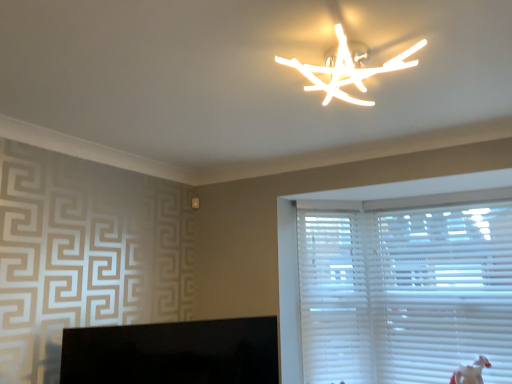
Describe the element at coordinates (337, 297) in the screenshot. I see `white plastic blinds at right` at that location.

Locate an element on the screen. The image size is (512, 384). white plastic blinds at right is located at coordinates (406, 287).

The width and height of the screenshot is (512, 384). In order to click on white plastic blinds at right in this screenshot , I will do `click(337, 297)`.

Find the location of a particular element. This screenshot has height=384, width=512. window blind below the white matte branch-like fixture at upper center (from the image's perspective) is located at coordinates (406, 287).

Considering the sizes of objects white matte branch-like fixture at upper center and white plastic blinds at right in the image provided, who is shorter, white matte branch-like fixture at upper center or white plastic blinds at right?

With less height is white matte branch-like fixture at upper center.

Can you confirm if white matte branch-like fixture at upper center is wider than white plastic blinds at right?

Correct, the width of white matte branch-like fixture at upper center exceeds that of white plastic blinds at right.

How much distance is there between white matte branch-like fixture at upper center and white plastic blinds at right?

A distance of 1.68 meters exists between white matte branch-like fixture at upper center and white plastic blinds at right.

How much distance is there between white plastic blinds at right and white matte branch-like fixture at upper center?

The distance of white plastic blinds at right from white matte branch-like fixture at upper center is 1.68 meters.

Is white matte branch-like fixture at upper center at the back of white plastic blinds at right?

No.

Is white plastic blinds at right inside the boundaries of white matte branch-like fixture at upper center, or outside?

white plastic blinds at right exists outside the volume of white matte branch-like fixture at upper center.

Does white plastic blinds at right have a greater height compared to white matte branch-like fixture at upper center?

Yes.

Where is `lamp above the white plastic blinds at right (from a real-world perspective)`? lamp above the white plastic blinds at right (from a real-world perspective) is located at coordinates (348, 68).

Which object is closer to the camera taking this photo, white matte branch-like fixture at upper center or white plastic blinds at right?

Positioned in front is white matte branch-like fixture at upper center.

Would you say white matte branch-like fixture at upper center contains white plastic blinds at right?

No, white plastic blinds at right is not a part of white matte branch-like fixture at upper center.

Based on the photo, between white plastic blinds at right and white plastic blinds at right, which one is positioned in front?

white plastic blinds at right is more forward.

Which of these two, white plastic blinds at right or white plastic blinds at right, stands shorter?

Standing shorter between the two is white plastic blinds at right.

From the image's perspective, between white plastic blinds at right and white plastic blinds at right, who is located below?

white plastic blinds at right is shown below in the image.

From a real-world perspective, is white plastic blinds at right positioned under white plastic blinds at right based on gravity?

No, from a real-world perspective, white plastic blinds at right is not beneath white plastic blinds at right.

Are white plastic blinds at right and black glossy monitor at lower left beside each other?

They are not placed beside each other.

Is black glossy monitor at lower left a part of white plastic blinds at right?

No, black glossy monitor at lower left is not a part of white plastic blinds at right.

Is white plastic blinds at right oriented away from black glossy monitor at lower left?

No, white plastic blinds at right's orientation is not away from black glossy monitor at lower left.

Which point is more distant from viewer, (310, 347) or (251, 373)?

The point (310, 347) is farther from the camera.

Is point (333, 70) less distant than point (206, 320)?

Yes, point (333, 70) is in front of point (206, 320).

Is white matte branch-like fixture at upper center to the right of black glossy monitor at lower left from the viewer's perspective?

Yes, white matte branch-like fixture at upper center is to the right of black glossy monitor at lower left.

How different are the orientations of white matte branch-like fixture at upper center and black glossy monitor at lower left in degrees?

The facing directions of white matte branch-like fixture at upper center and black glossy monitor at lower left are 55.8 degrees apart.

Is white matte branch-like fixture at upper center smaller than black glossy monitor at lower left?

Yes.

Which of these two, white plastic blinds at right or black glossy monitor at lower left, is wider?

Wider between the two is white plastic blinds at right.

Is white plastic blinds at right beside black glossy monitor at lower left?

There is a gap between white plastic blinds at right and black glossy monitor at lower left.

Consider the image. Do you think white plastic blinds at right is within black glossy monitor at lower left, or outside of it?

white plastic blinds at right is outside black glossy monitor at lower left.

Image resolution: width=512 pixels, height=384 pixels. What are the coordinates of `window blind that appears below the white matte branch-like fixture at upper center (from the image's perspective)` in the screenshot? It's located at (406, 287).

Locate an element on the screen. lamp above the white plastic blinds at right (from a real-world perspective) is located at coordinates (348, 68).

Which object lies further to the anchor point white matte branch-like fixture at upper center, white plastic blinds at right or black glossy monitor at lower left?

white plastic blinds at right is further to white matte branch-like fixture at upper center.

When comparing their distances from white plastic blinds at right, does white plastic blinds at right or white matte branch-like fixture at upper center seem closer?

Based on the image, white plastic blinds at right appears to be nearer to white plastic blinds at right.

When comparing their distances from white plastic blinds at right, does black glossy monitor at lower left or white plastic blinds at right seem closer?

white plastic blinds at right is closer to white plastic blinds at right.

Based on their spatial positions, is black glossy monitor at lower left or white matte branch-like fixture at upper center closer to white plastic blinds at right?

Based on the image, black glossy monitor at lower left appears to be nearer to white plastic blinds at right.

Looking at the image, which one is located further to white matte branch-like fixture at upper center, white plastic blinds at right or black glossy monitor at lower left?

The object further to white matte branch-like fixture at upper center is white plastic blinds at right.

Which object lies nearer to the anchor point black glossy monitor at lower left, white matte branch-like fixture at upper center or white plastic blinds at right?

white plastic blinds at right is positioned closer to the anchor black glossy monitor at lower left.

From the image, which object appears to be nearer to black glossy monitor at lower left, white plastic blinds at right or white plastic blinds at right?

The object closer to black glossy monitor at lower left is white plastic blinds at right.

Which object lies nearer to the anchor point white plastic blinds at right, white matte branch-like fixture at upper center or white plastic blinds at right?

white plastic blinds at right.

Find the location of a particular element. This screenshot has height=384, width=512. computer monitor between white matte branch-like fixture at upper center and white plastic blinds at right along the z-axis is located at coordinates (173, 353).

This screenshot has height=384, width=512. Find the location of `blind between black glossy monitor at lower left and white plastic blinds at right from left to right`. blind between black glossy monitor at lower left and white plastic blinds at right from left to right is located at coordinates (337, 297).

The height and width of the screenshot is (384, 512). I want to click on window blind located between white matte branch-like fixture at upper center and white plastic blinds at right in the depth direction, so click(406, 287).

Locate an element on the screen. lamp between black glossy monitor at lower left and white plastic blinds at right is located at coordinates (348, 68).